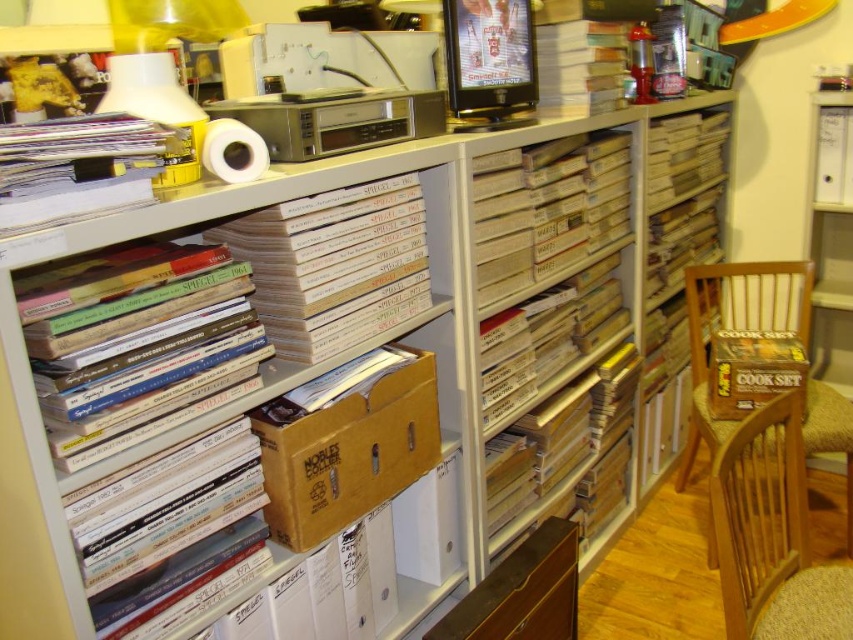
You are sitting on the brown wooden chair at lower right and want to reach the brown cardboard box at right. Can you directly touch the box without moving the chair?

The brown wooden chair at lower right is in front of the brown cardboard box at right, so you can directly touch the box without moving the chair because the chair is positioned closer to you than the box.